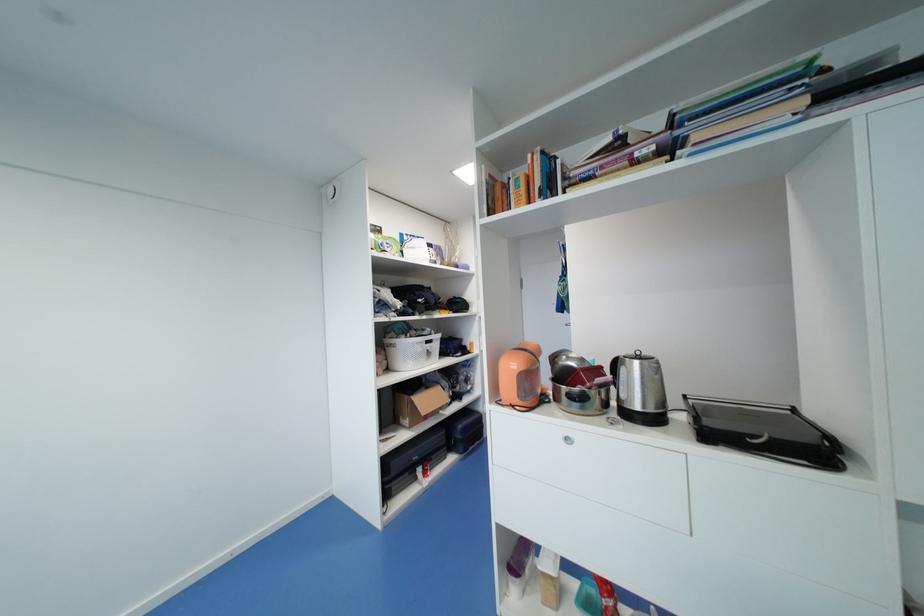
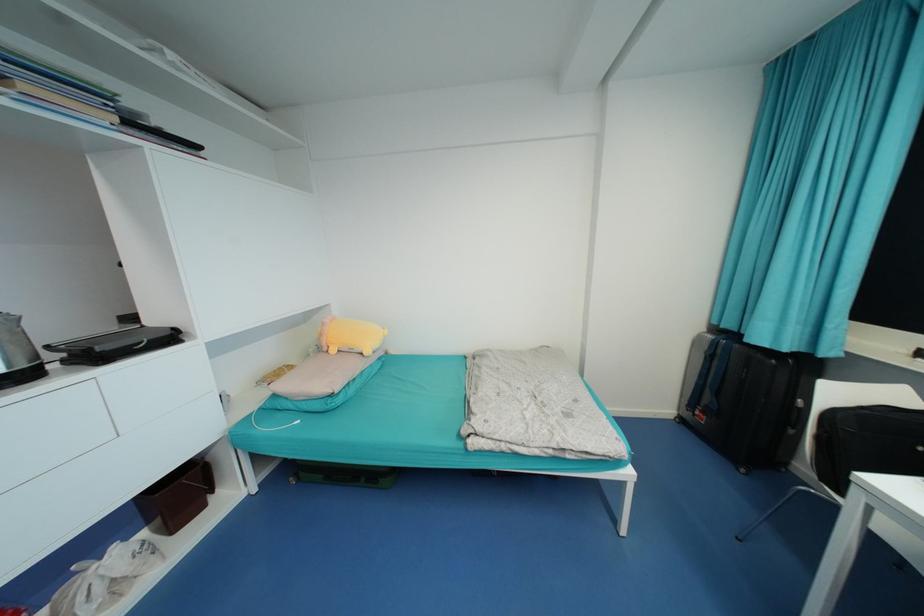
Question: The images are taken continuously from a first-person perspective. In which direction is your viewpoint rotating?

Choices:
 (A) Left
 (B) Right
 (C) Up
 (D) Down

Answer: (B)